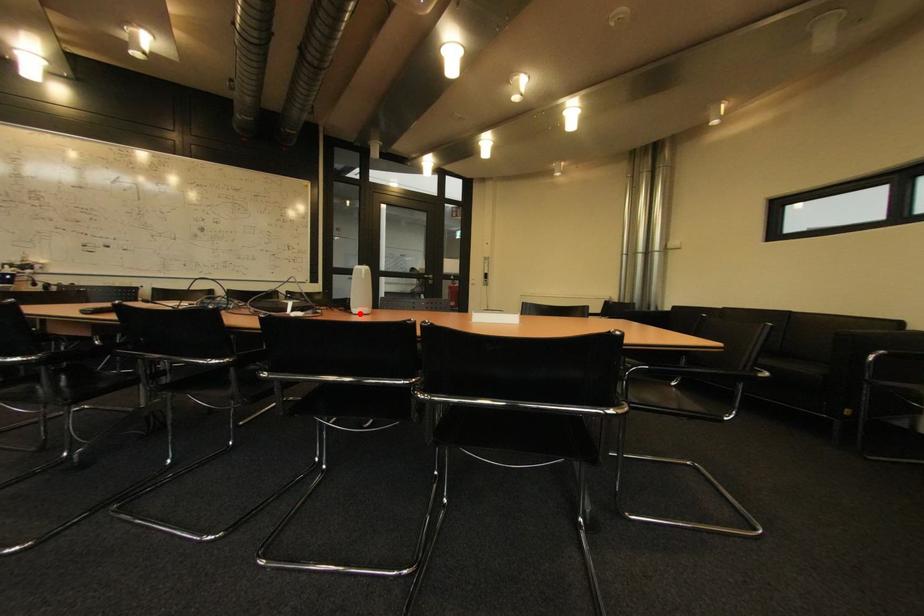
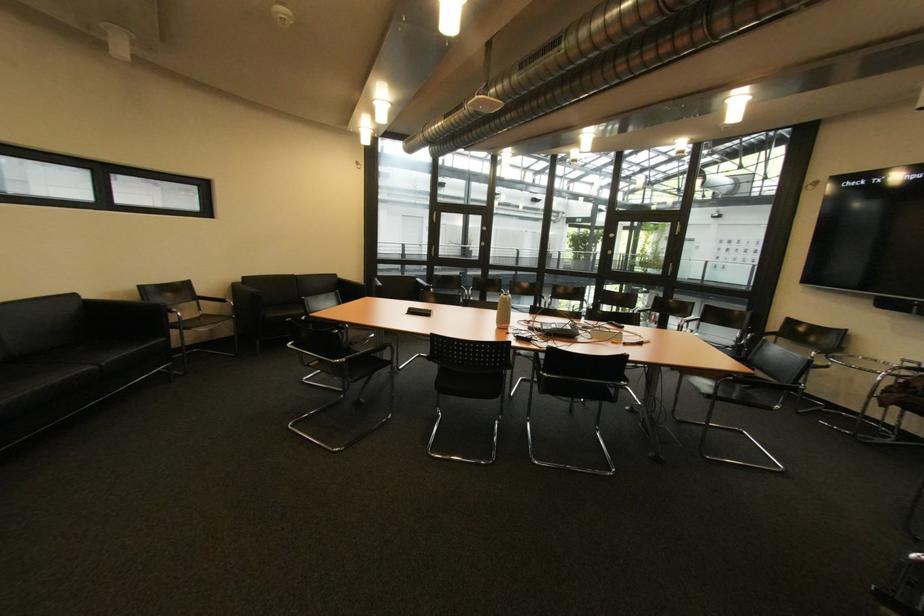
Question: I am providing you with two images of the same scene from different viewpoints. A red point is marked on the first image. At the location where the point appears in image 1, is it still visible in image 2?

Choices:
 (A) Yes
 (B) No

Answer: (B)